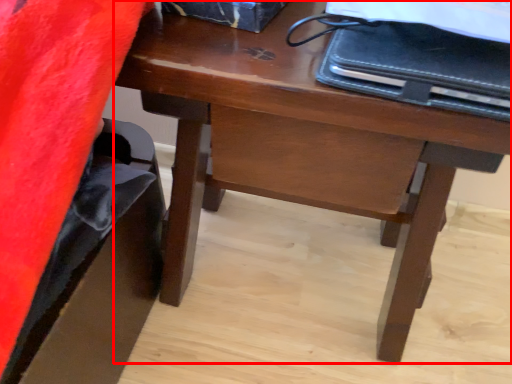
Question: Considering the relative positions of desk (annotated by the red box) and notebook in the image provided, where is desk (annotated by the red box) located with respect to the staircase?

Choices:
 (A) left
 (B) right

Answer: (A)